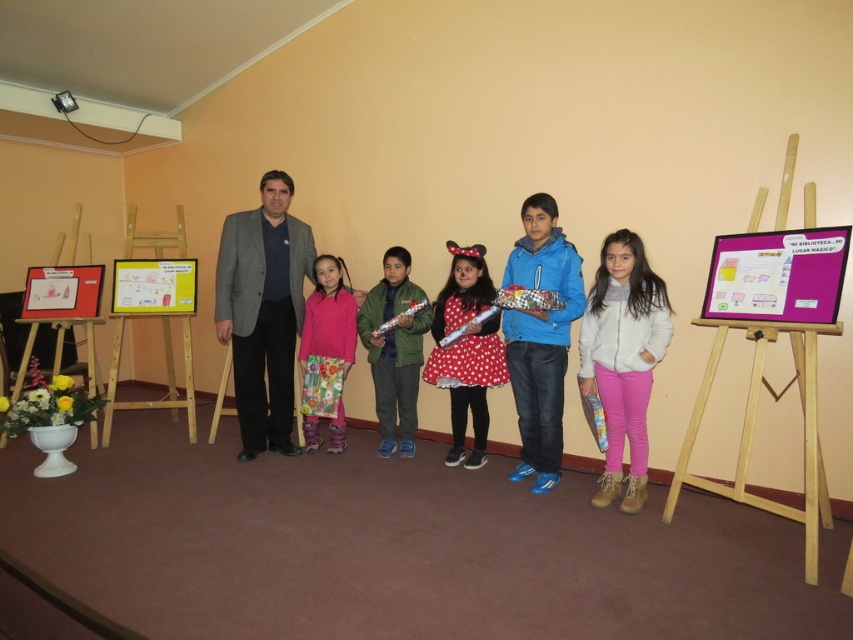
How distant is gray woolen suit at center from wooden easel at right?

A distance of 2.45 meters exists between gray woolen suit at center and wooden easel at right.

Does gray woolen suit at center have a larger size compared to wooden easel at right?

Yes.

Is point (244, 324) positioned before point (804, 189)?

That is False.

Image resolution: width=853 pixels, height=640 pixels. In order to click on gray woolen suit at center in this screenshot , I will do `click(263, 310)`.

Who is positioned more to the right, red polka dot dress at center or green matte jacket at center?

red polka dot dress at center is more to the right.

Which is in front, point (460, 257) or point (366, 333)?

Positioned in front is point (460, 257).

Locate an element on the screen. red polka dot dress at center is located at coordinates (x=466, y=349).

The width and height of the screenshot is (853, 640). I want to click on red polka dot dress at center, so click(466, 349).

Can you confirm if matte gray suit at center is shorter than gray woolen suit at center?

Indeed, matte gray suit at center has a lesser height compared to gray woolen suit at center.

Which is in front, point (546, 218) or point (263, 284)?

Point (546, 218)

In order to click on matte gray suit at center in this screenshot , I will do `click(583, 348)`.